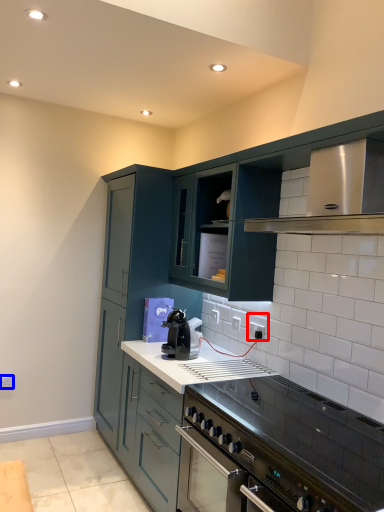
Question: Among these objects, which one is farthest to the camera, electric outlet (highlighted by a red box) or electric outlet (highlighted by a blue box)?

Choices:
 (A) electric outlet
 (B) electric outlet

Answer: (B)